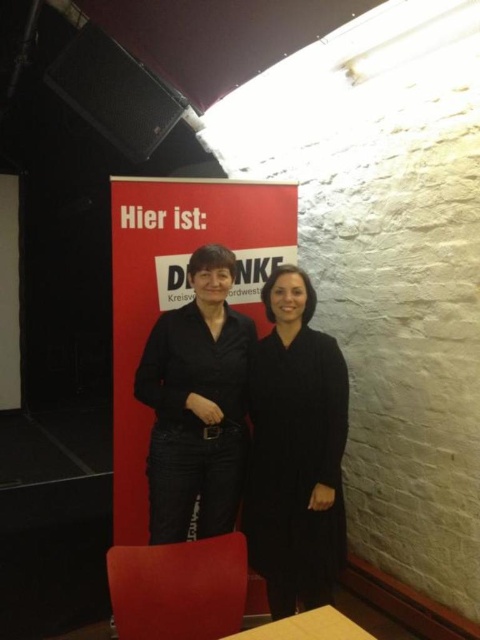
You are standing in front of the red banner and want to touch the black matte jacket at center. Where should you move to in terms of direction and distance relative to the banner?

The black matte jacket at center is located at coordinates 0.631 on the x axis and 0.410 on the y axis relative to the banner, so move towards the right and slightly forward to reach it.

You are organizing a photo shoot and need to position a light source to the left of the yellow matte table at lower center. Will the black wool coat at center block the light from reaching the table?

The black wool coat at center is to the right of the yellow matte table at lower center, so placing the light source to the left of the table would not be blocked by the coat.